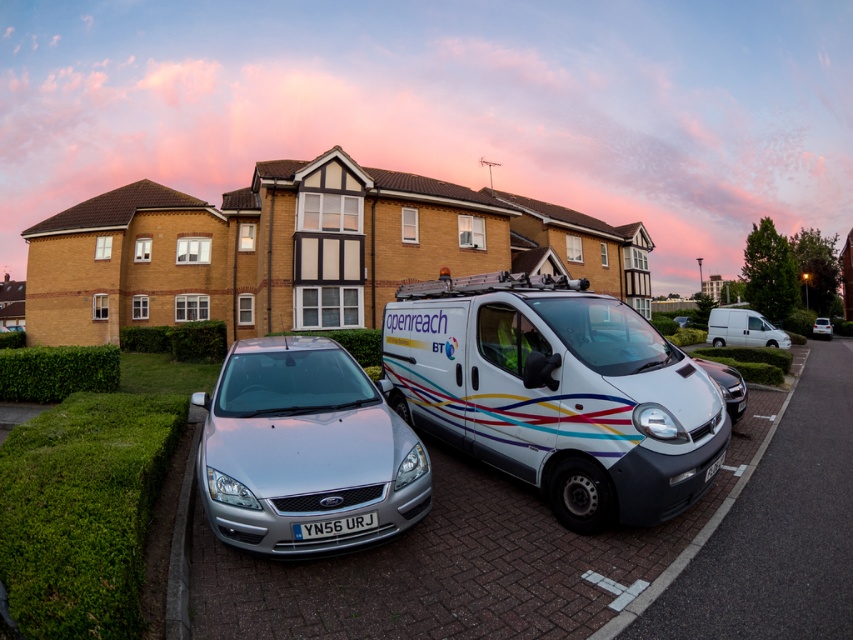
You are a delivery person who needs to park your van between the silver metallic hatchback at right and the white plastic license plate at center. Is there enough space between them to fit your van?

The silver metallic hatchback at right might be wider than the white plastic license plate at center, so there might not be enough space to fit your van between them.

You are a pedestrian standing on the sidewalk and looking at the silver metallic hatchback at right and the white plastic license plate at center. Which object is closer to you?

The silver metallic hatchback at right is closer to you because it is further to the viewer than the white plastic license plate at center.

You are a delivery driver who needs to back out of the parking spot. There is a white glossy van at center and a silver metallic car at center. Which vehicle should you avoid hitting when reversing?

The white glossy van at center is positioned over the silver metallic car at center, so you should avoid hitting the white glossy van at center as it is directly in your path when reversing.